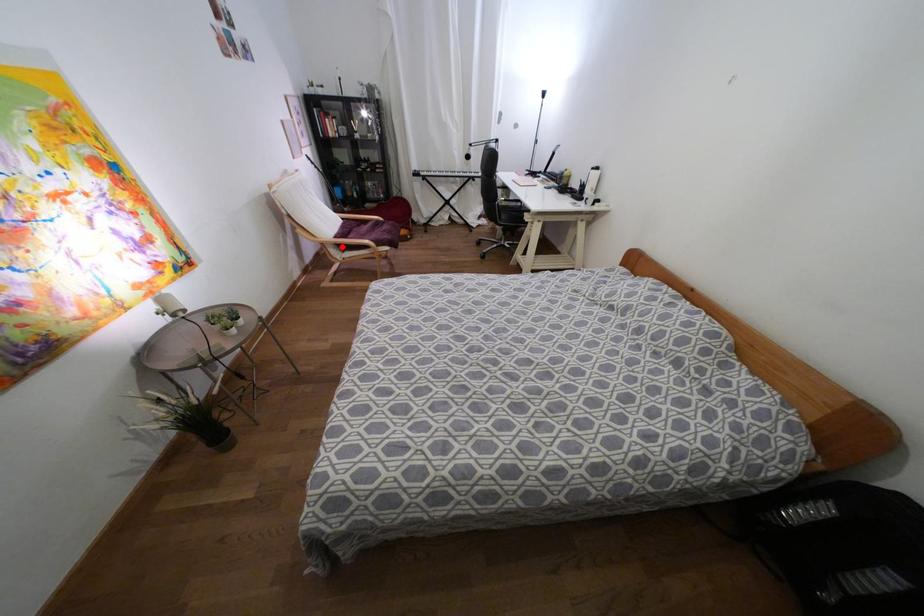
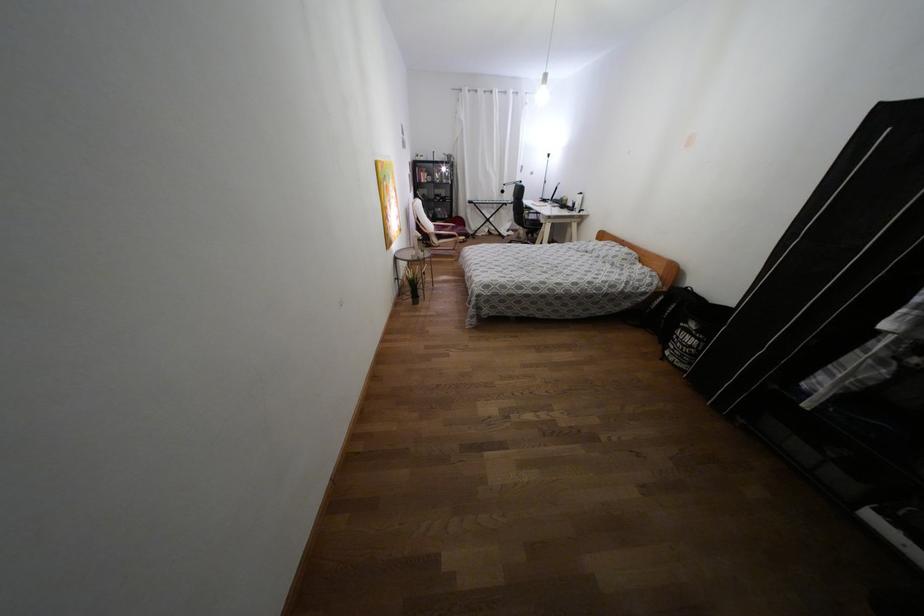
Where in the second image is the point corresponding to the highlighted location from the first image?

(439, 237)